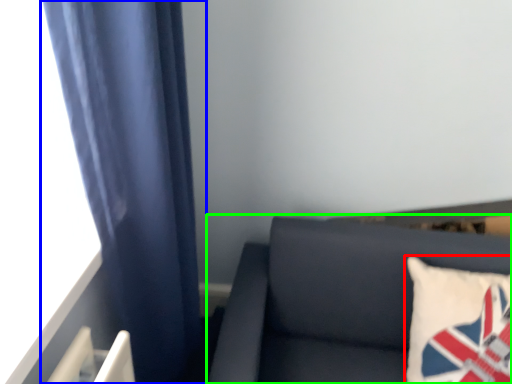
Question: Estimate the real-world distances between objects in this image. Which object is farther from pillow (highlighted by a red box), curtain (highlighted by a blue box) or furniture (highlighted by a green box)?

Choices:
 (A) curtain
 (B) furniture

Answer: (A)